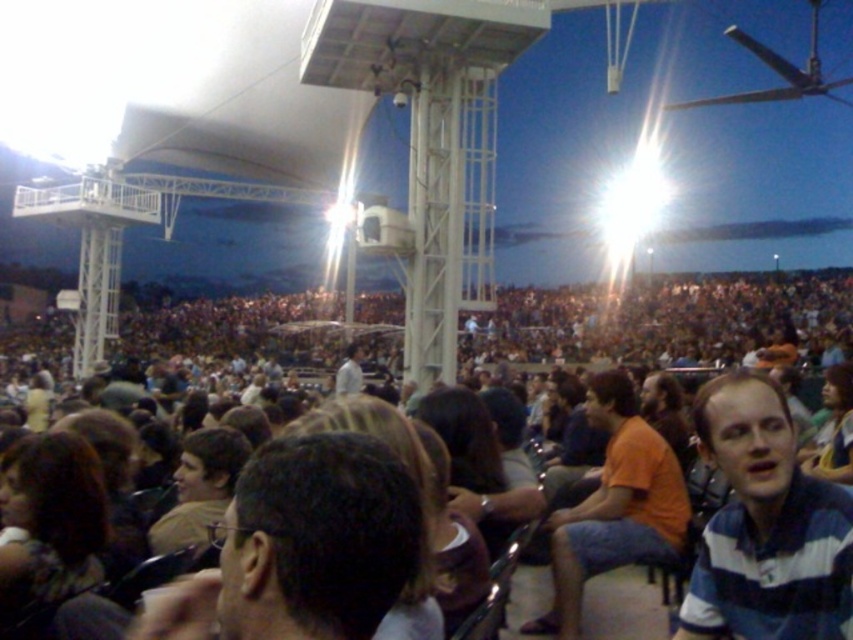
You are attending an evening concert and notice two people sitting in front of you wearing an orange cotton shirt at center and a white matte shirt at center. Which shirt is located to the right of the other?

The orange cotton shirt at center is positioned on the right side of white matte shirt at center.

You are a photographer at the event and want to capture both the orange cotton shirt at center and the white matte shirt at center in a single photo. Which shirt should you focus on to ensure both are in frame without needing to adjust your camera angle?

The orange cotton shirt at center is taller than the white matte shirt at center, so focusing on the orange cotton shirt at center will ensure both are visible without adjusting the camera angle.